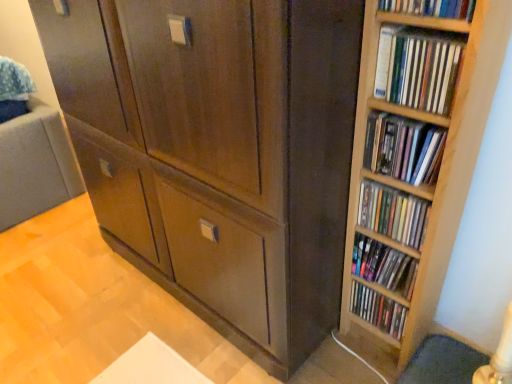
Question: Does matte brown cabinet at center have a greater width compared to wooden bookshelf at right, which is the fifth book from bottom to top?

Choices:
 (A) yes
 (B) no

Answer: (A)

Question: Can you confirm if matte brown cabinet at center is shorter than wooden bookshelf at right, which is the fifth book from bottom to top?

Choices:
 (A) no
 (B) yes

Answer: (A)

Question: Can we say matte brown cabinet at center lies outside wooden bookshelf at right, which is the fifth book from bottom to top?

Choices:
 (A) yes
 (B) no

Answer: (A)

Question: Is matte brown cabinet at center in contact with wooden bookshelf at right, marked as the 2th book in a top-to-bottom arrangement?

Choices:
 (A) no
 (B) yes

Answer: (A)

Question: Considering the relative positions of matte brown cabinet at center and wooden bookshelf at right, which is the fifth book from bottom to top, in the image provided, is matte brown cabinet at center to the right of wooden bookshelf at right, which is the fifth book from bottom to top, from the viewer's perspective?

Choices:
 (A) yes
 (B) no

Answer: (B)

Question: Is matte brown cabinet at center thinner than wooden bookshelf at right, marked as the 2th book in a top-to-bottom arrangement?

Choices:
 (A) yes
 (B) no

Answer: (B)

Question: Is wooden bookshelf at right, the fourth book positioned from the bottom, wider than wooden bookshelf at upper right, the sixth book positioned from the bottom?

Choices:
 (A) no
 (B) yes

Answer: (B)

Question: Can you see wooden bookshelf at right, the 3th book from the top, touching wooden bookshelf at upper right, the sixth book positioned from the bottom?

Choices:
 (A) no
 (B) yes

Answer: (A)

Question: Is wooden bookshelf at right, the 3th book from the top, thinner than wooden bookshelf at upper right, arranged as the 1th book when viewed from the top?

Choices:
 (A) yes
 (B) no

Answer: (B)

Question: From the image's perspective, is wooden bookshelf at right, the 3th book from the top, on top of wooden bookshelf at upper right, the sixth book positioned from the bottom?

Choices:
 (A) no
 (B) yes

Answer: (A)

Question: Is wooden bookshelf at right, the 3th book from the top, taller than wooden bookshelf at upper right, the sixth book positioned from the bottom?

Choices:
 (A) yes
 (B) no

Answer: (B)

Question: Can you confirm if wooden bookshelf at right, the 3th book from the top, is bigger than wooden bookshelf at upper right, the sixth book positioned from the bottom?

Choices:
 (A) yes
 (B) no

Answer: (A)

Question: Considering the relative sizes of wooden bookshelf at right, marked as the 2th book in a top-to-bottom arrangement, and matte wooden shelf at right, the fifth book from the top, in the image provided, is wooden bookshelf at right, marked as the 2th book in a top-to-bottom arrangement, wider than matte wooden shelf at right, the fifth book from the top,?

Choices:
 (A) no
 (B) yes

Answer: (A)